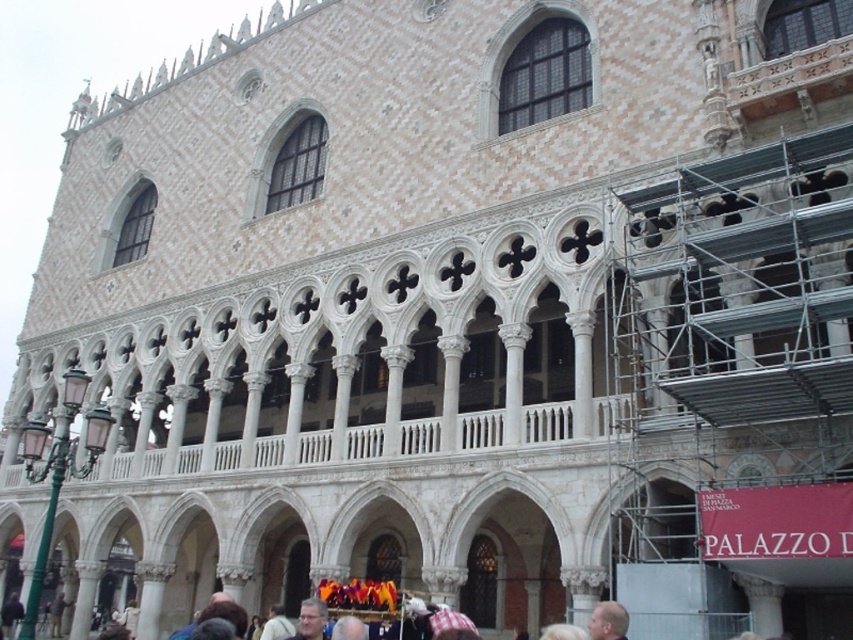
Is blonde hair at lower right below gray hair at center?

No.

Does blonde hair at lower right appear on the right side of gray hair at center?

Correct, you'll find blonde hair at lower right to the right of gray hair at center.

Between point (619, 621) and point (306, 602), which one is positioned in front?

Point (619, 621) is in front.

Where is `blonde hair at lower right`? The width and height of the screenshot is (853, 640). blonde hair at lower right is located at coordinates (608, 621).